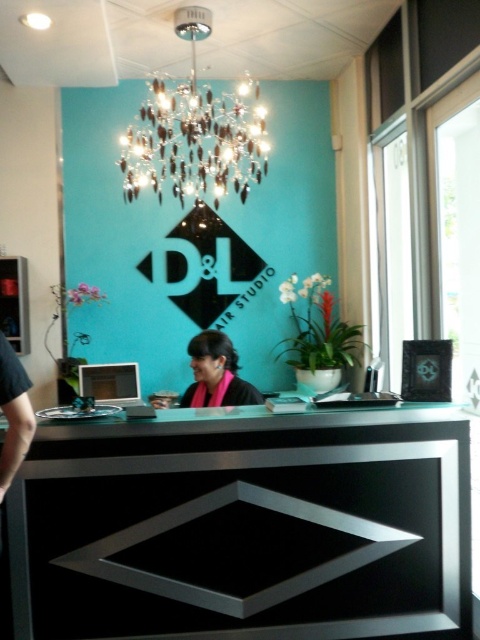
Question: Which object is positioned closest to the black glossy table at center?

Choices:
 (A) crystal glass chandelier at upper center
 (B) pink fabric scarf at center

Answer: (B)

Question: Does crystal glass chandelier at upper center have a greater width compared to pink fabric scarf at center?

Choices:
 (A) yes
 (B) no

Answer: (A)

Question: Is black glossy table at center to the left of crystal glass chandelier at upper center from the viewer's perspective?

Choices:
 (A) yes
 (B) no

Answer: (B)

Question: Which of the following is the farthest from the observer?

Choices:
 (A) (190, 349)
 (B) (188, 531)
 (C) (153, 188)

Answer: (C)

Question: Is black glossy table at center to the left of crystal glass chandelier at upper center from the viewer's perspective?

Choices:
 (A) yes
 (B) no

Answer: (B)

Question: Which point is farther to the camera?

Choices:
 (A) crystal glass chandelier at upper center
 (B) pink fabric scarf at center
 (C) black glossy table at center

Answer: (A)